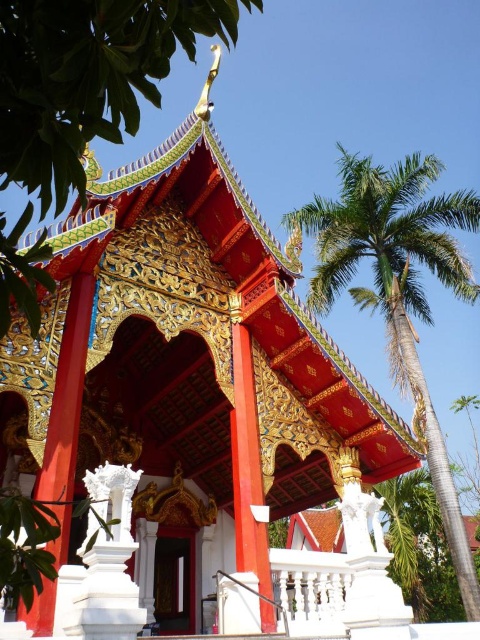
Does green glossy tree at upper center have a greater width compared to green leafy palm tree at upper right?

No, green glossy tree at upper center is not wider than green leafy palm tree at upper right.

Can you confirm if green glossy tree at upper center is positioned to the right of green leafy palm tree at upper right?

No, green glossy tree at upper center is not to the right of green leafy palm tree at upper right.

The width and height of the screenshot is (480, 640). I want to click on green glossy tree at upper center, so click(87, 77).

Find the location of a particular element. green glossy tree at upper center is located at coordinates (87, 77).